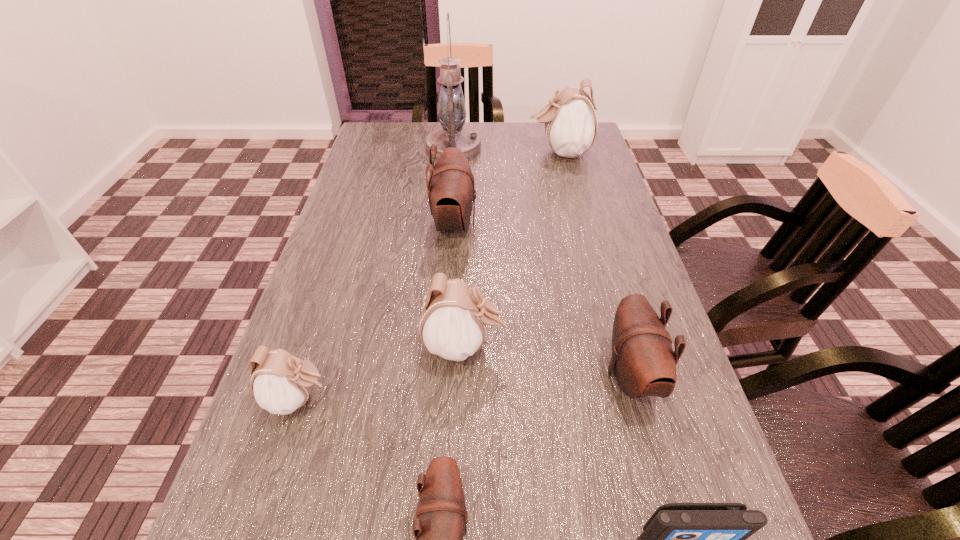
This screenshot has height=540, width=960. I want to click on oil lamp located at the far edge, so click(452, 114).

Locate an element on the screen. pouch that is at the far edge is located at coordinates (570, 122).

Locate an element on the screen. Image resolution: width=960 pixels, height=540 pixels. object situated at the left edge is located at coordinates (281, 383).

Find the location of `object that is at the far right corner`. object that is at the far right corner is located at coordinates [570, 122].

In order to click on vacant space at the far edge of the desktop in this screenshot , I will do `click(438, 123)`.

You are a GUI agent. You are given a task and a screenshot of the screen. Output one action in this format:
    pyautogui.click(x=<x>, y=<y>)
    Task: Click on the vacant space at the left edge of the desktop
    Image resolution: width=960 pixels, height=540 pixels.
    Given the screenshot: What is the action you would take?
    pyautogui.click(x=369, y=251)

Image resolution: width=960 pixels, height=540 pixels. In the image, there is a desktop. Find the location of `vacant space at the right edge`. vacant space at the right edge is located at coordinates (576, 252).

Identify the location of vacant space at the far right corner of the desktop. This screenshot has width=960, height=540. (556, 156).

You are a GUI agent. You are given a task and a screenshot of the screen. Output one action in this format:
    pyautogui.click(x=<x>, y=<y>)
    Task: Click on the unoccupied position between the leftmost pouch and the rightmost brown pouch
    
    Given the screenshot: What is the action you would take?
    pyautogui.click(x=465, y=387)

Find the location of a particular element. free space between the rightmost brown pouch and the biggest brown pouch is located at coordinates point(542,299).